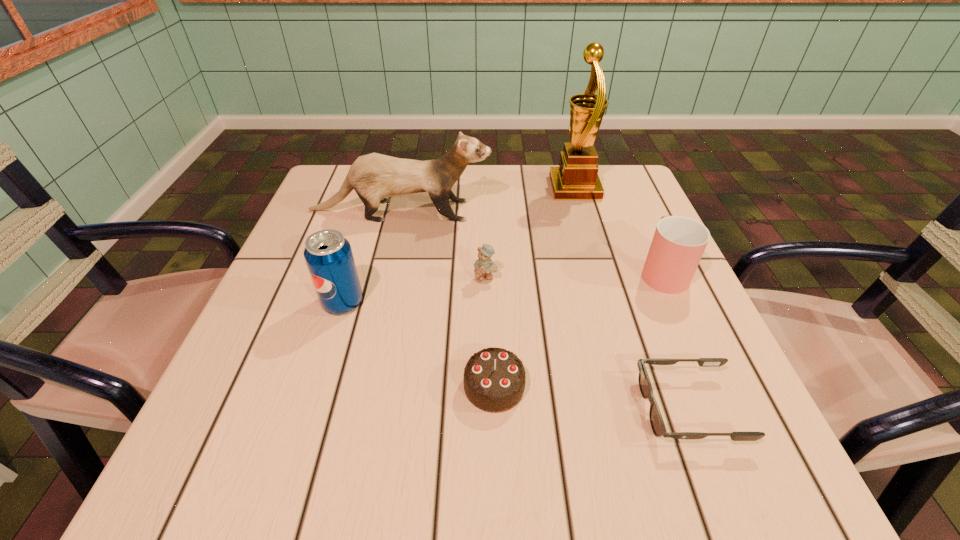
Find the location of a particular element. object that is positioned at the near right corner is located at coordinates (658, 427).

Where is `free location at the far edge`? The height and width of the screenshot is (540, 960). free location at the far edge is located at coordinates [422, 198].

This screenshot has height=540, width=960. In the image, there is a desktop. What are the coordinates of `free space at the near edge` in the screenshot? It's located at (332, 471).

This screenshot has width=960, height=540. Find the location of `free location at the left edge of the desktop`. free location at the left edge of the desktop is located at coordinates (274, 301).

In the image, there is a desktop. Find the location of `free region at the right edge`. free region at the right edge is located at coordinates (644, 318).

The height and width of the screenshot is (540, 960). In the image, there is a desktop. Identify the location of free region at the near left corner. (209, 472).

I want to click on free space at the far right corner, so [x=599, y=201].

Identify the location of vacant point located between the ferret and the teddy bear. (443, 245).

Locate an element on the screen. The image size is (960, 540). free space between the chocolate cake and the teddy bear is located at coordinates (490, 333).

Identify the location of free space between the ferret and the third tallest object. Image resolution: width=960 pixels, height=540 pixels. click(372, 256).